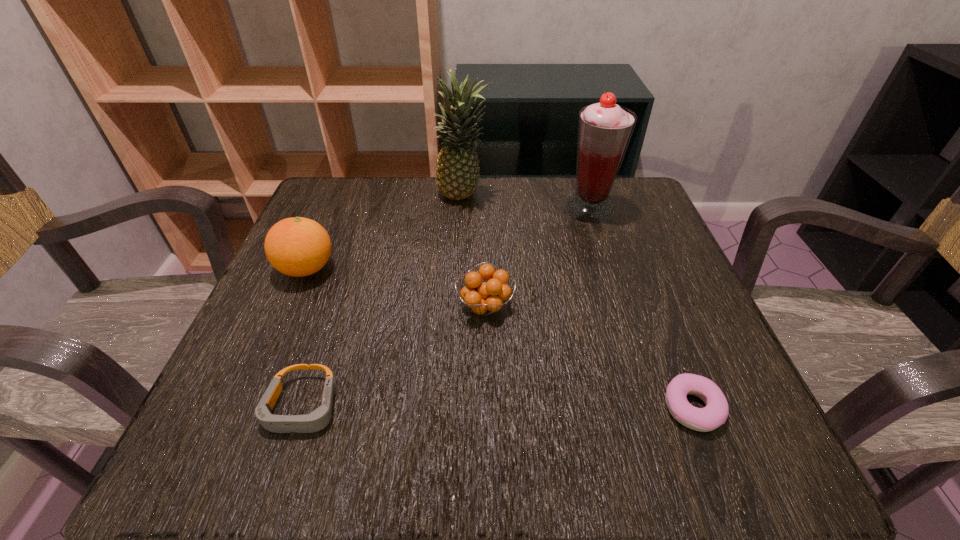
You are a GUI agent. You are given a task and a screenshot of the screen. Output one action in this format:
    pyautogui.click(x=<x>, y=<y>)
    Task: Click on the pineapple
    
    Given the screenshot: What is the action you would take?
    pyautogui.click(x=457, y=167)

Image resolution: width=960 pixels, height=540 pixels. In order to click on smoothie in this screenshot , I will do `click(604, 129)`.

I want to click on the taller orange fruit, so click(x=297, y=247).

The width and height of the screenshot is (960, 540). Identify the location of the third tallest object. (297, 247).

You are a GUI agent. You are given a task and a screenshot of the screen. Output one action in this format:
    pyautogui.click(x=<x>, y=<y>)
    Task: Click on the shorter orange fruit
    Image resolution: width=960 pixels, height=540 pixels.
    Given the screenshot: What is the action you would take?
    pyautogui.click(x=484, y=299)

Locate an element on the screen. the right orange fruit is located at coordinates (484, 299).

I want to click on goggles, so click(x=317, y=420).

Where is `pastry`? pastry is located at coordinates coord(715,413).

At what (x,y) coordinates should I click in order to perform the action: click on blank space located 0.180m on the right of the pineapple. Please return your answer as a coordinate pair (x, y). Looking at the image, I should click on (564, 197).

Find the location of a particular element. The height and width of the screenshot is (540, 960). blank space located 0.400m on the front of the smoothie is located at coordinates (642, 374).